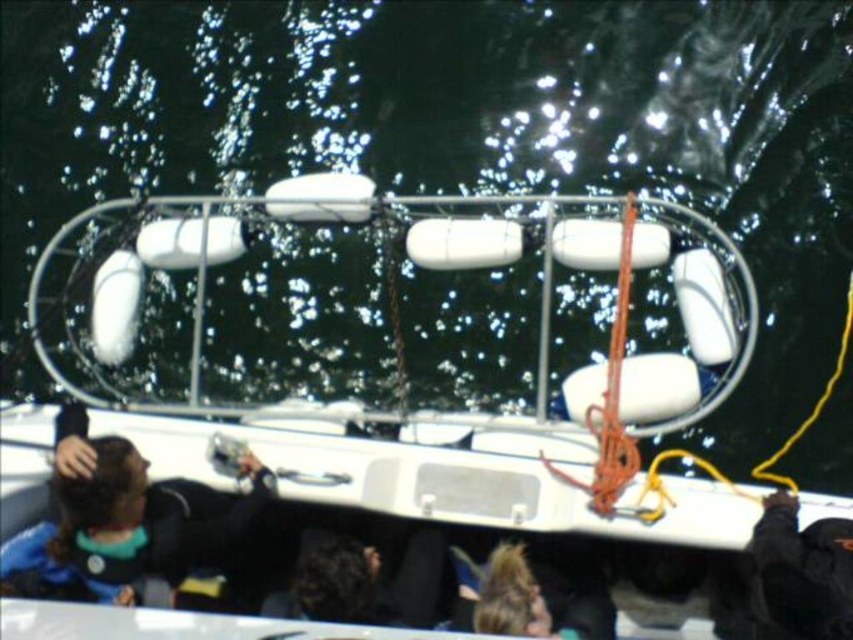
Does white matte lifebuoys at center appear under blue fabric jacket at lower left?

Incorrect, white matte lifebuoys at center is not positioned below blue fabric jacket at lower left.

Who is lower down, white matte lifebuoys at center or blue fabric jacket at lower left?

blue fabric jacket at lower left is below.

Is point (1, 454) closer to viewer compared to point (128, 483)?

That is False.

Image resolution: width=853 pixels, height=640 pixels. Identify the location of white matte lifebuoys at center. (404, 426).